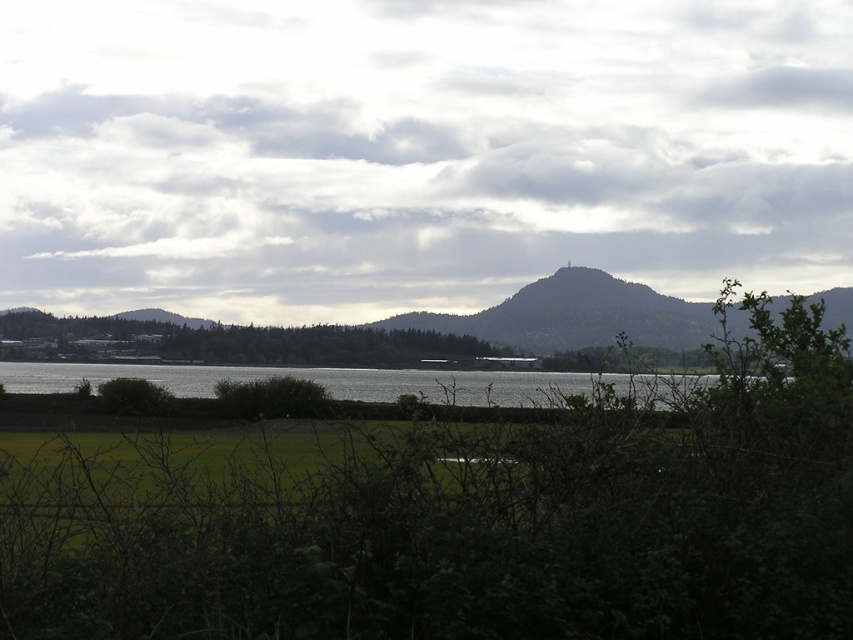
Looking at this image, you are an artist trying to paint this landscape. You want to ensure the cloudy sky at upper center and the silvery reflective water at center are positioned correctly according to their spatial relationship. Which object should be placed further back in the painting to create depth?

The silvery reflective water at center should be placed further back in the painting because it is behind the cloudy sky at upper center, creating depth by positioning it behind the sky.

You are standing at the edge of the water in the serene landscape. You see two points marked in the image, point 1 at coordinates point [699,60] and point 2 at coordinates point [537,298]. Which point is closer to you?

Point [699,60] is further to the camera than point [537,298], so point 2 at coordinates point [537,298] is closer to you.